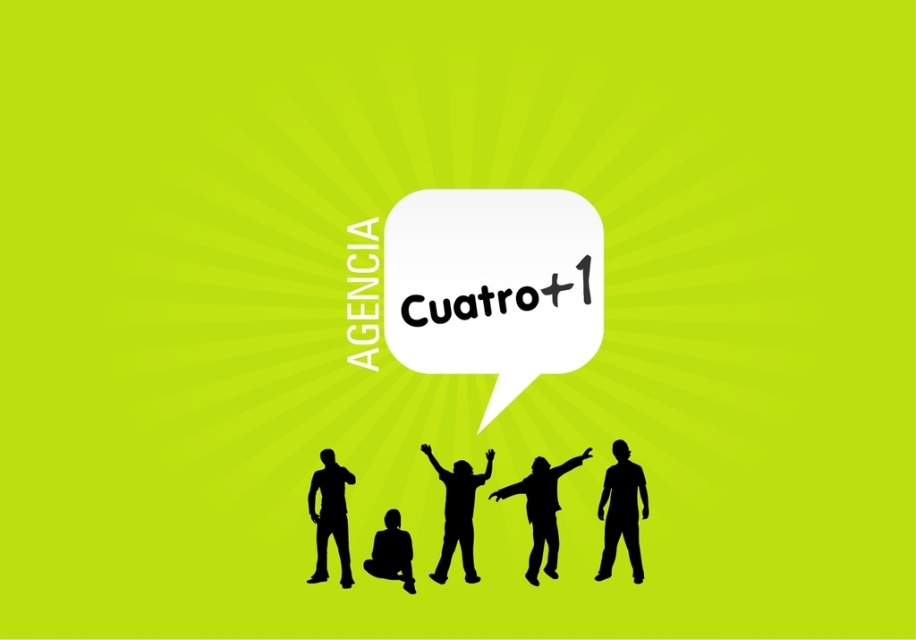
This screenshot has width=916, height=640. I want to click on black matte person at center, so click(458, 513).

Locate an element on the screen. The height and width of the screenshot is (640, 916). black matte person at center is located at coordinates (458, 513).

Is black matte figure at center closer to the viewer compared to black matte figure at lower center?

That is False.

Does black matte figure at center have a greater width compared to black matte figure at lower center?

Indeed, black matte figure at center has a greater width compared to black matte figure at lower center.

Image resolution: width=916 pixels, height=640 pixels. What do you see at coordinates (541, 509) in the screenshot? I see `black matte figure at center` at bounding box center [541, 509].

The width and height of the screenshot is (916, 640). I want to click on black matte figure at center, so click(541, 509).

Does black silhouette figure at lower right have a larger size compared to black matte person at center?

Incorrect, black silhouette figure at lower right is not larger than black matte person at center.

Can you confirm if black silhouette figure at lower right is shorter than black matte person at center?

Yes.

Does point (608, 499) come in front of point (465, 544)?

No, (608, 499) is further to viewer.

Identify the location of black silhouette figure at lower right. This screenshot has height=640, width=916. (620, 509).